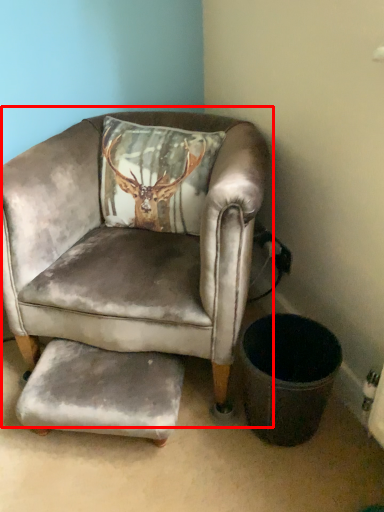
Question: From the image's perspective, considering the relative positions of chair (annotated by the red box) and footrest in the image provided, where is chair (annotated by the red box) located with respect to the staircase?

Choices:
 (A) above
 (B) below

Answer: (A)